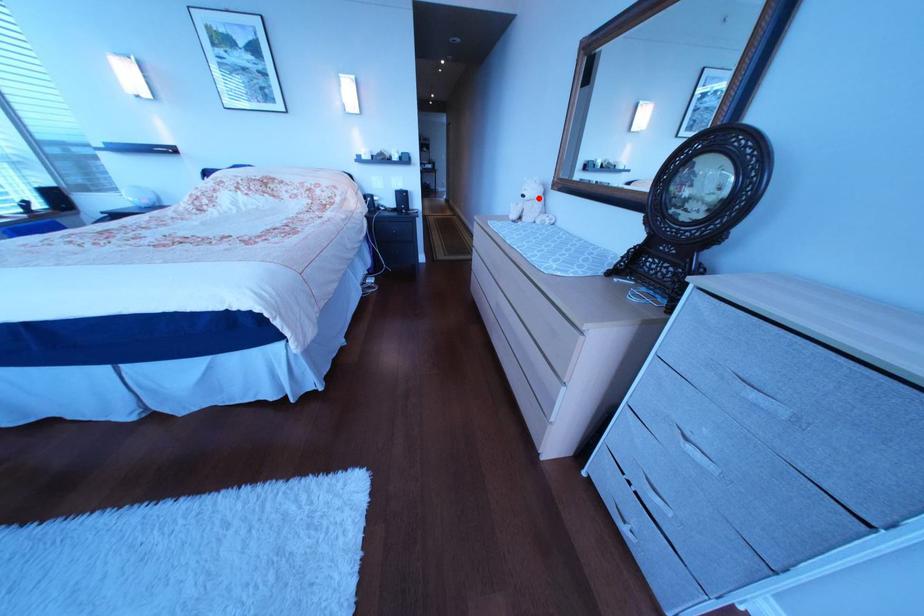
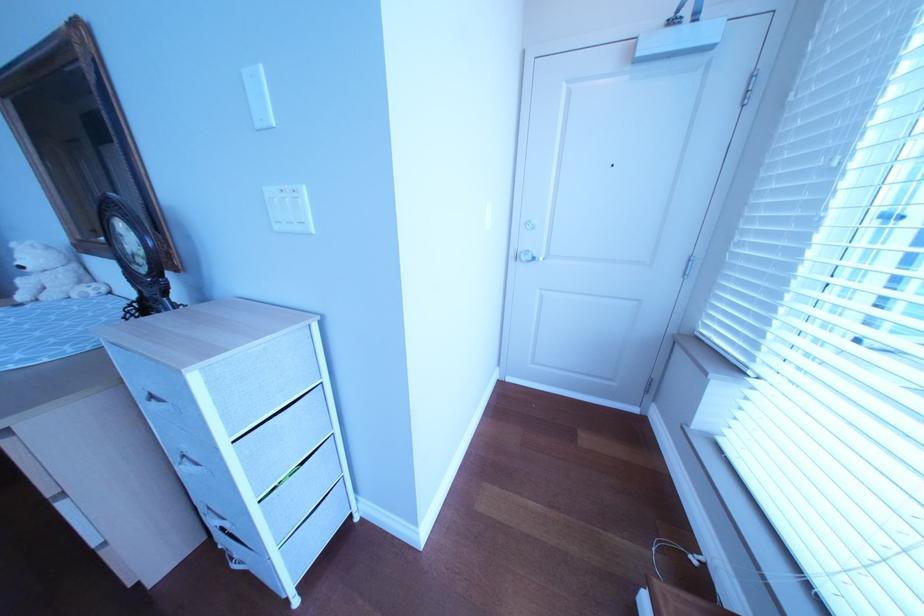
Question: I am providing you with two images of the same scene from different viewpoints. In image1, a red point is highlighted. Considering the same 3D point in image2, which of the following is correct?

Choices:
 (A) It is closer
 (B) It is farther

Answer: (A)